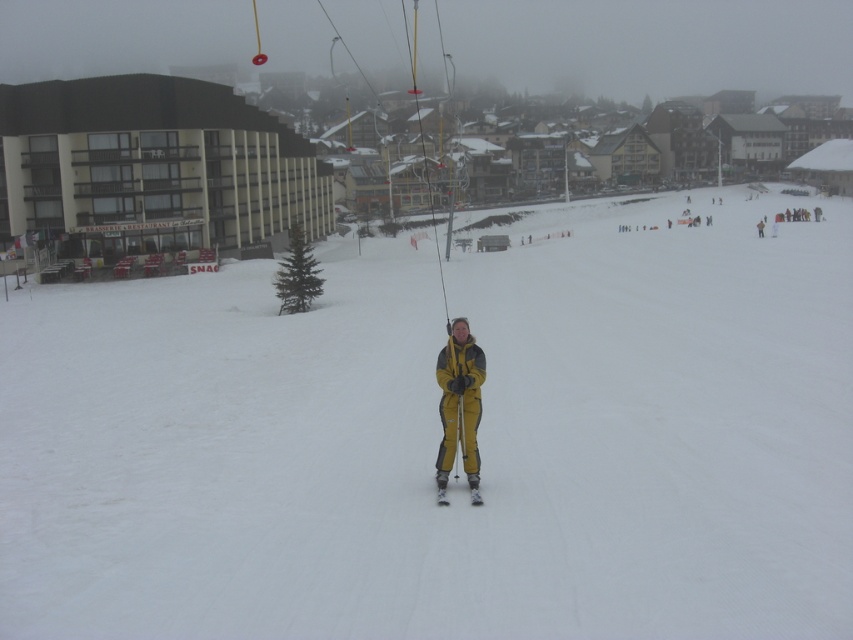
You are a photographer standing at the base of the ski resort. You want to capture a clear photo of the white snow ski slope at center. Considering your camera can focus on objects up to 5 meters away, will you need to adjust your position to take the photo?

The white snow ski slope at center is 6.07 meters away from the camera, which is beyond the camera focus range of 5 meters. To capture a clear photo, you need to move closer to the white snow ski slope at center so it is within the 5 meter focus range.

Looking at this image, you are a photographer planning to capture a closeup shot of the yellow matte ski suit at center and the yellow matte ski at center. Given that your camera lens can only focus on objects within a 10cm depth range, can you determine if both objects will be in focus at the same time?

The yellow matte ski suit at center is larger in size than yellow matte ski at center. However, size does not affect focus depth. To determine if both are within the 10cm depth range, their actual distances from the camera must be known. Without specific distance information, it cannot be confirmed if both will be in focus simultaneously.